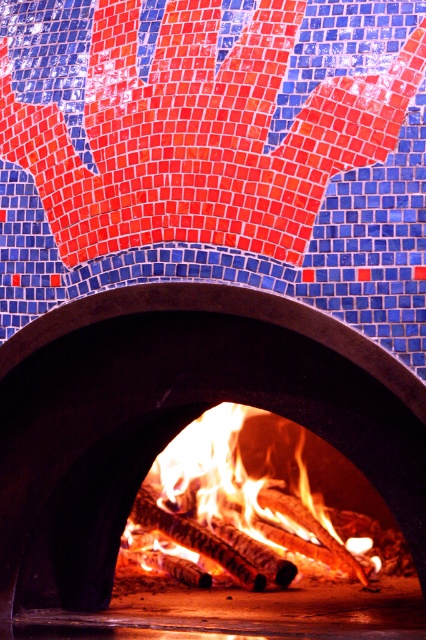
Can you confirm if blue mosaic tile at upper center is positioned below black stone oven at center?

No.

Based on the photo, can you confirm if blue mosaic tile at upper center is wider than black stone oven at center?

No, blue mosaic tile at upper center is not wider than black stone oven at center.

Which is behind, point (423, 273) or point (161, 445)?

The point (161, 445) is more distant.

This screenshot has width=426, height=640. In order to click on blue mosaic tile at upper center in this screenshot , I will do (216, 154).

Between black stone oven at center and flaming wood at center, which one appears on the right side from the viewer's perspective?

→ flaming wood at center

Between black stone oven at center and flaming wood at center, which one has less height?

With less height is flaming wood at center.

Between point (423, 508) and point (253, 508), which one is positioned in front?

Point (423, 508)

Locate an element on the screen. The height and width of the screenshot is (640, 426). black stone oven at center is located at coordinates (178, 413).

Does blue mosaic tile at upper center appear on the right side of flaming wood at center?

No, blue mosaic tile at upper center is not to the right of flaming wood at center.

Does blue mosaic tile at upper center appear on the left side of flaming wood at center?

Yes, blue mosaic tile at upper center is to the left of flaming wood at center.

Is point (69, 269) in front of point (279, 497)?

Yes, point (69, 269) is in front of point (279, 497).

Identify the location of blue mosaic tile at upper center. The width and height of the screenshot is (426, 640). (216, 154).